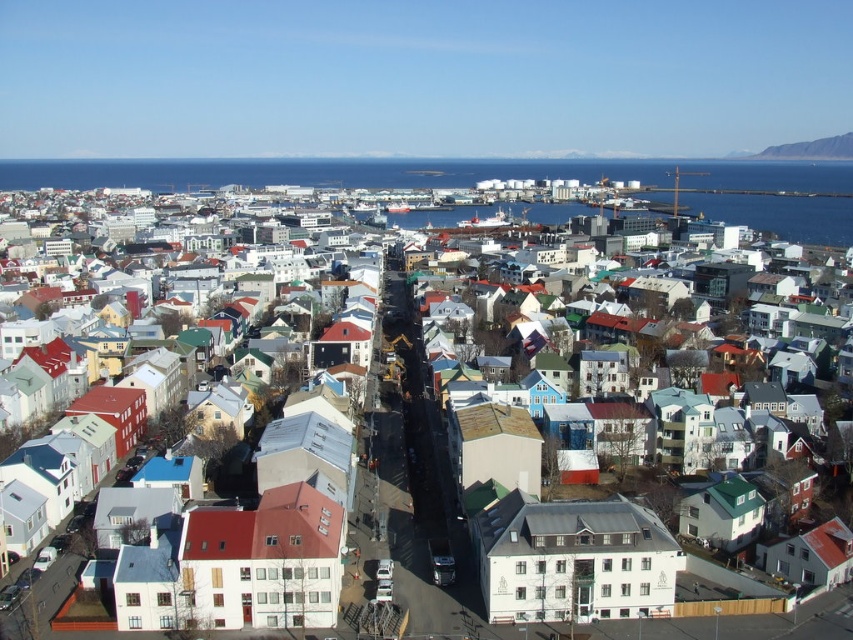
You are a drone operator trying to deliver a package to a specific location marked by the point at coordinates point [636,164]. The drone has a maximum range of 2000 feet. Based on the scene, can the drone reach the point without exceeding its range?

The point [636,164] is 2062.37 feet away from the camera, which exceeds the drone operator drone maximum range of 2000 feet. Therefore, the drone cannot reach the point without exceeding its range.

You are a city planner reviewing this urban layout. You notice the rugged rock cliff at upper right and the white matte building at center. Which object is located higher in the image?

The rugged rock cliff at upper right is positioned over the white matte building at center, so it is higher in the image.